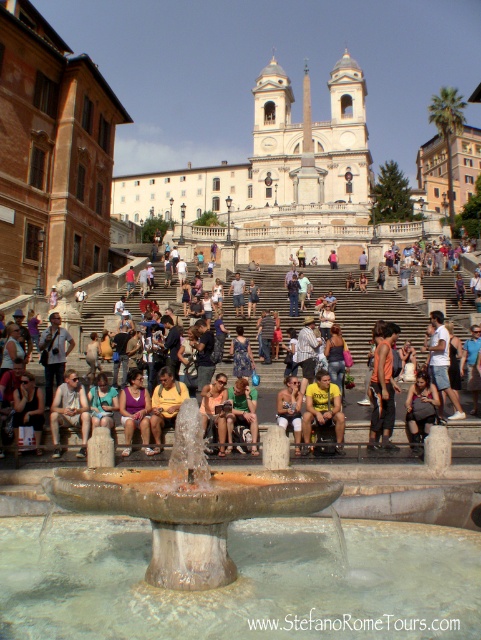
Between orange fabric shirt at center and purple fabric dress at lower center, which one is positioned lower?

purple fabric dress at lower center is below.

The width and height of the screenshot is (481, 640). What do you see at coordinates (382, 388) in the screenshot? I see `orange fabric shirt at center` at bounding box center [382, 388].

Locate an element on the screen. orange fabric shirt at center is located at coordinates (382, 388).

Consider the image. Can you confirm if stone fountain at center is smaller than orange fabric shirt at center?

No.

Between stone fountain at center and orange fabric shirt at center, which one is positioned higher?

orange fabric shirt at center

Is point (148, 484) positioned before point (384, 403)?

Yes, it is in front of point (384, 403).

Identify the location of stone fountain at center. (190, 502).

Who is positioned more to the right, yellow fabric shirt at center or purple fabric dress at lower center?

yellow fabric shirt at center

Between yellow fabric shirt at center and purple fabric dress at lower center, which one is positioned lower?

purple fabric dress at lower center is below.

Locate an element on the screen. yellow fabric shirt at center is located at coordinates (323, 406).